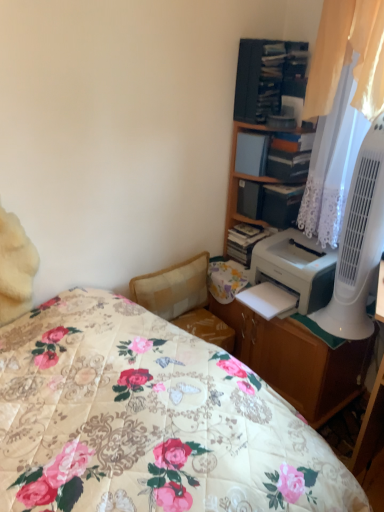
Question: From the image's perspective, is white plastic fan at right under matte plastic shelf at upper right, marked as the 2th shelf in a top-to-bottom arrangement?

Choices:
 (A) yes
 (B) no

Answer: (A)

Question: Is white plastic fan at right smaller than matte plastic shelf at upper right, marked as the 2th shelf in a top-to-bottom arrangement?

Choices:
 (A) no
 (B) yes

Answer: (A)

Question: Does white plastic fan at right have a greater width compared to matte plastic shelf at upper right, marked as the 2th shelf in a top-to-bottom arrangement?

Choices:
 (A) no
 (B) yes

Answer: (B)

Question: From a real-world perspective, is white plastic fan at right over matte plastic shelf at upper right, the 1th shelf in the bottom-to-top sequence?

Choices:
 (A) yes
 (B) no

Answer: (A)

Question: Does white plastic fan at right come behind matte plastic shelf at upper right, the 1th shelf in the bottom-to-top sequence?

Choices:
 (A) no
 (B) yes

Answer: (A)

Question: Is white plastic fan at right directly adjacent to matte plastic shelf at upper right, marked as the 2th shelf in a top-to-bottom arrangement?

Choices:
 (A) yes
 (B) no

Answer: (B)

Question: Does white plastic printer at right have a lesser width compared to wooden bookshelf at upper right, which appears as the second shelf when ordered from the bottom?

Choices:
 (A) yes
 (B) no

Answer: (B)

Question: Is white plastic printer at right in front of wooden bookshelf at upper right, which appears as the second shelf when ordered from the bottom?

Choices:
 (A) no
 (B) yes

Answer: (B)

Question: Is white plastic printer at right further to camera compared to wooden bookshelf at upper right, which appears as the second shelf when ordered from the bottom?

Choices:
 (A) no
 (B) yes

Answer: (A)

Question: Is white plastic printer at right to the left of wooden bookshelf at upper right, which appears as the 1th shelf when viewed from the top, from the viewer's perspective?

Choices:
 (A) yes
 (B) no

Answer: (B)

Question: Is white plastic printer at right oriented away from wooden bookshelf at upper right, which appears as the second shelf when ordered from the bottom?

Choices:
 (A) no
 (B) yes

Answer: (A)

Question: From a real-world perspective, is white plastic printer at right located beneath wooden bookshelf at upper right, which appears as the second shelf when ordered from the bottom?

Choices:
 (A) yes
 (B) no

Answer: (A)

Question: Is white plastic fan at right looking in the opposite direction of beige fabric swivel chair at center?

Choices:
 (A) no
 (B) yes

Answer: (A)